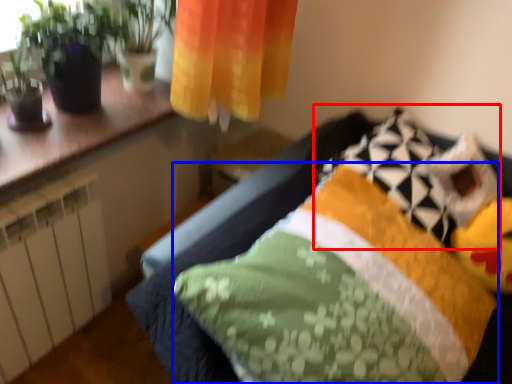
Question: Which of the following is the closest to the observer, pillow (highlighted by a red box) or pillow (highlighted by a blue box)?

Choices:
 (A) pillow
 (B) pillow

Answer: (B)